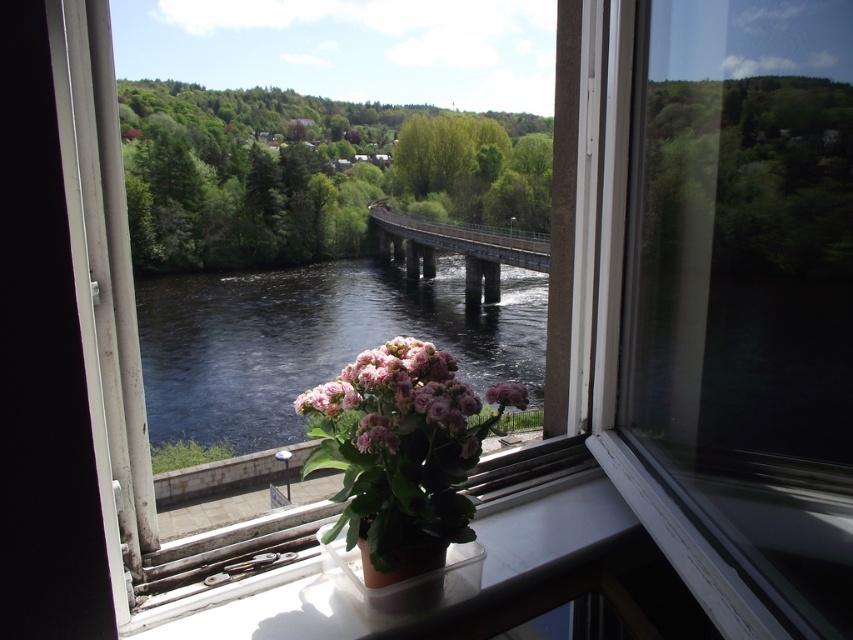
You are an artist trying to sketch the scene from the window. You want to place the pink matte flower at center accurately. According to the coordinates given, where should you position it on your drawing canvas?

The pink matte flower at center should be positioned at the coordinates point 0.625 on the x axis and 0.467 on the y axis on your drawing canvas.

You are standing in front of a window with a potted plant on the sill. There is a point marked at coordinates (480, 404) in the scene. If you want to touch that point with a 1.5 meter long stick, will the stick be long enough?

The point at coordinates (480, 404) is 1.21 meters away from the viewer. Since the stick is 1.5 meters long, which is longer than the distance, the stick will be long enough to reach the point.

You are standing at the window looking out. There are two points marked on the scene. The first point is at coordinate point(x=392, y=353) and the second at point(x=384, y=604). Which point is closer to you?

Point(x=392, y=353) is in front of point(x=384, y=604), so it is closer to you.